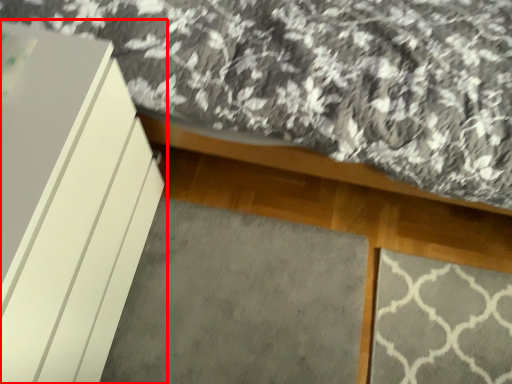
Question: In this image, where is furniture (annotated by the red box) located relative to mat?

Choices:
 (A) right
 (B) left

Answer: (B)